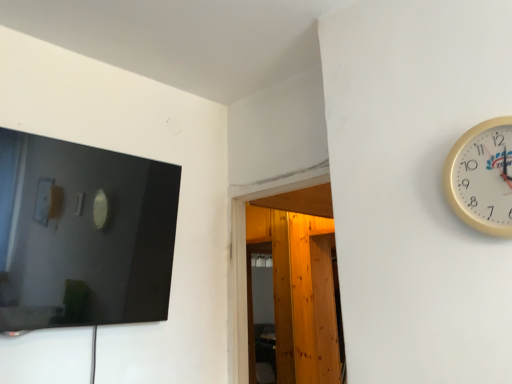
Question: Considering the positions of transparent wooden door at center and white plastic wall clock at right in the image, is transparent wooden door at center wider or thinner than white plastic wall clock at right?

Choices:
 (A) wide
 (B) thin

Answer: (A)

Question: Is point (273, 249) positioned closer to the camera than point (460, 195)?

Choices:
 (A) closer
 (B) farther

Answer: (B)

Question: From the image's perspective, is transparent wooden door at center located above or below white plastic wall clock at right?

Choices:
 (A) above
 (B) below

Answer: (B)

Question: Is white plastic wall clock at right spatially inside transparent wooden door at center, or outside of it?

Choices:
 (A) inside
 (B) outside

Answer: (B)

Question: In terms of size, does white plastic wall clock at right appear bigger or smaller than transparent wooden door at center?

Choices:
 (A) big
 (B) small

Answer: (B)

Question: From a real-world perspective, is white plastic wall clock at right physically located above or below transparent wooden door at center?

Choices:
 (A) below
 (B) above

Answer: (B)

Question: From the image's perspective, is white plastic wall clock at right located above or below transparent wooden door at center?

Choices:
 (A) below
 (B) above

Answer: (B)